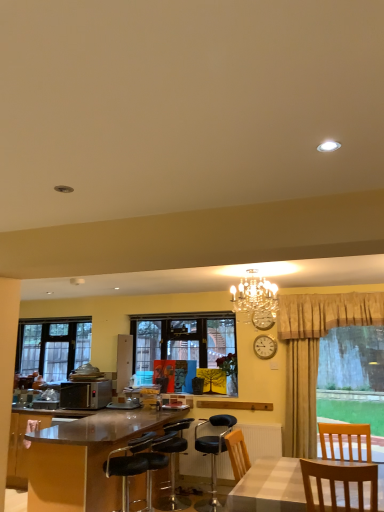
Image resolution: width=384 pixels, height=512 pixels. I want to click on vacant space situated above black leather bar stool at center, the first chair from the back (from a real-world perspective), so click(x=168, y=421).